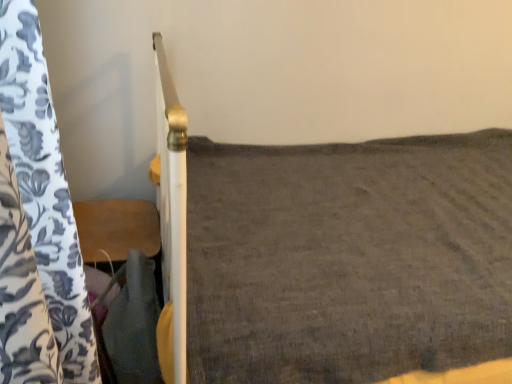
Describe the element at coordinates (348, 258) in the screenshot. The width and height of the screenshot is (512, 384). I see `dark gray fabric at center` at that location.

You are a GUI agent. You are given a task and a screenshot of the screen. Output one action in this format:
    pyautogui.click(x=<x>, y=<y>)
    Task: Click on the dark gray fabric at center
    This screenshot has height=384, width=512.
    Given the screenshot: What is the action you would take?
    pyautogui.click(x=348, y=258)

Locate an element on the screen. dark gray fabric at center is located at coordinates (348, 258).